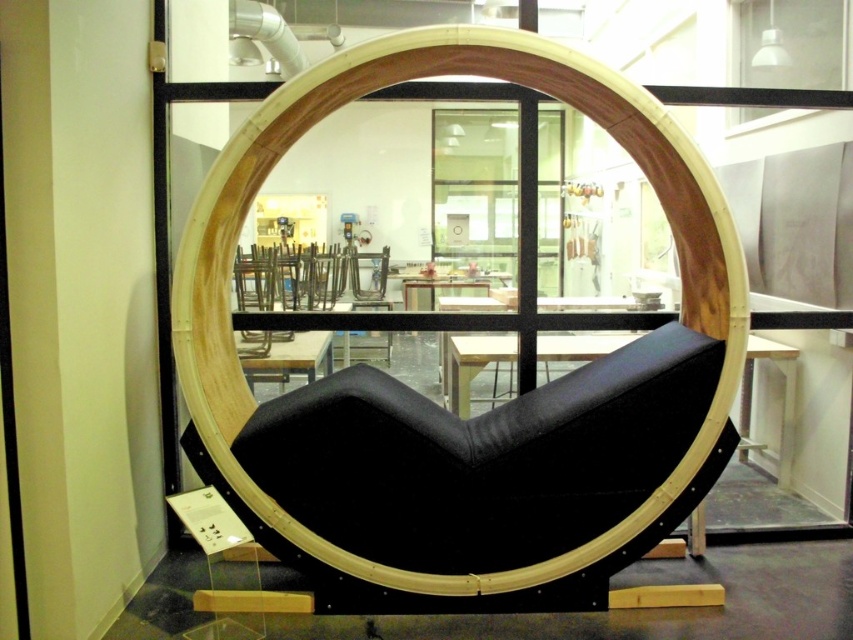
Question: Is black fabric cushion at center closer to camera compared to matte black table at center?

Choices:
 (A) no
 (B) yes

Answer: (B)

Question: Does transparent glass window at upper center have a smaller size compared to black fabric cushion at center?

Choices:
 (A) yes
 (B) no

Answer: (A)

Question: Can you confirm if matte black table at center is wider than velvet black chair at center?

Choices:
 (A) no
 (B) yes

Answer: (A)

Question: Estimate the real-world distances between objects in this image. Which object is farther from the transparent glass window at upper center?

Choices:
 (A) black matte table at center
 (B) velvet black chair at center

Answer: (B)

Question: Which is nearer to the matte black table at center?

Choices:
 (A) black matte table at center
 (B) velvet black chair at center

Answer: (A)

Question: Which point is closer to the camera?

Choices:
 (A) (370, 298)
 (B) (466, 368)
 (C) (248, 342)

Answer: (B)